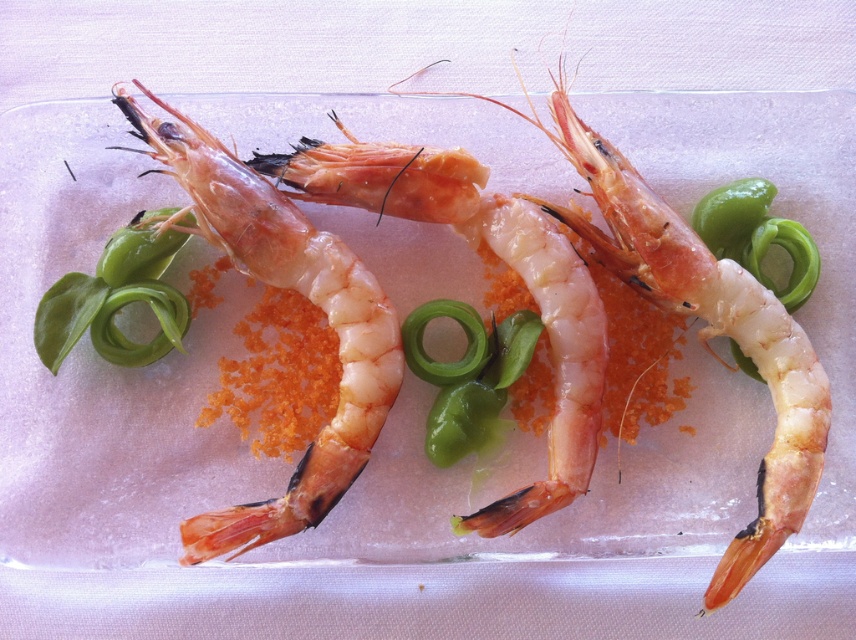
Question: Can you confirm if pink translucent shrimp at center is positioned above green translucent onion at center?

Choices:
 (A) yes
 (B) no

Answer: (B)

Question: Is pinkish translucent shrimp at center positioned at the back of green translucent onion at center?

Choices:
 (A) no
 (B) yes

Answer: (A)

Question: Which object is farther from the camera taking this photo?

Choices:
 (A) green rubber band at center
 (B) pink translucent shrimp at center
 (C) pinkish translucent shrimp at center
 (D) translucent pink shrimp at center

Answer: (A)

Question: Which point is closer to the camera?

Choices:
 (A) translucent pink shrimp at center
 (B) pink translucent shrimp at center

Answer: (A)

Question: Considering the relative positions of translucent pink shrimp at center and green translucent onion at center in the image provided, where is translucent pink shrimp at center located with respect to green translucent onion at center?

Choices:
 (A) below
 (B) above

Answer: (A)

Question: Which of the following is the farthest from the observer?

Choices:
 (A) green rubber band at center
 (B) green glossy vegetable at upper left

Answer: (A)